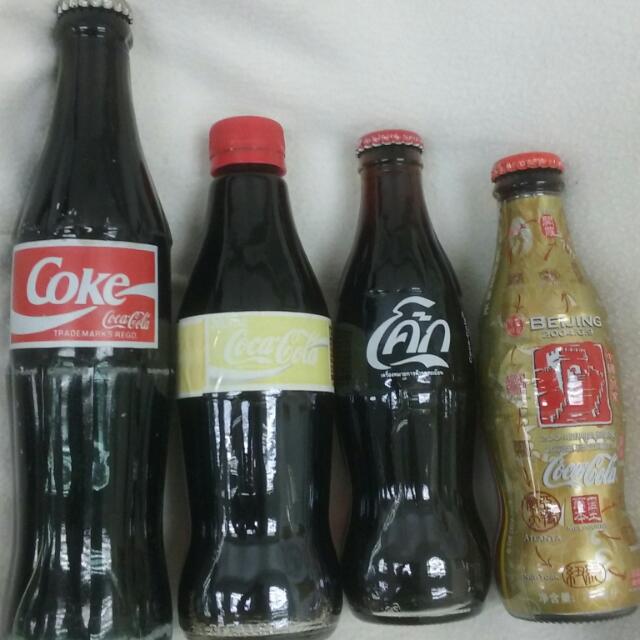
The height and width of the screenshot is (640, 640). What are the coordinates of `bottles` in the screenshot? It's located at (98, 220), (266, 292), (402, 292), (539, 301).